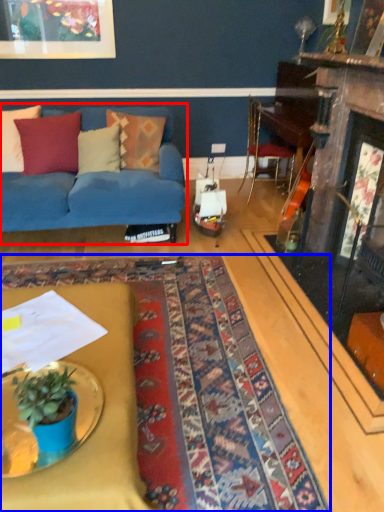
Question: Which of the following is the farthest to the observer, studio couch (highlighted by a red box) or mat (highlighted by a blue box)?

Choices:
 (A) studio couch
 (B) mat

Answer: (A)